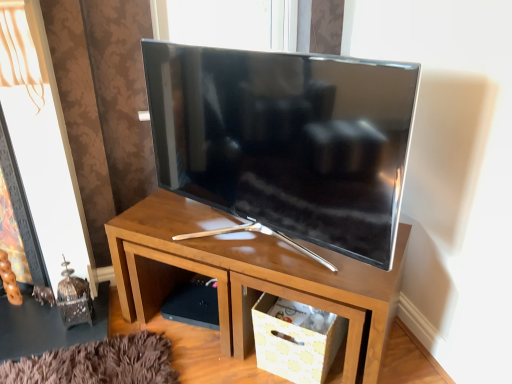
Question: Does wooden tv stand at center appear on the left side of white paper storage box at lower right?

Choices:
 (A) yes
 (B) no

Answer: (A)

Question: From the image's perspective, is wooden tv stand at center below white paper storage box at lower right?

Choices:
 (A) yes
 (B) no

Answer: (B)

Question: Could you tell me if wooden tv stand at center is facing white paper storage box at lower right?

Choices:
 (A) no
 (B) yes

Answer: (B)

Question: Is wooden tv stand at center to the right of white paper storage box at lower right from the viewer's perspective?

Choices:
 (A) no
 (B) yes

Answer: (A)

Question: Is wooden tv stand at center further to the viewer compared to white paper storage box at lower right?

Choices:
 (A) yes
 (B) no

Answer: (B)

Question: From the image's perspective, does wooden tv stand at center appear higher than white paper storage box at lower right?

Choices:
 (A) yes
 (B) no

Answer: (A)

Question: Does white paper storage box at lower right have a greater height compared to wooden tv stand at center?

Choices:
 (A) no
 (B) yes

Answer: (A)

Question: Can you confirm if white paper storage box at lower right is wider than wooden tv stand at center?

Choices:
 (A) no
 (B) yes

Answer: (A)

Question: Is white paper storage box at lower right further to the viewer compared to wooden tv stand at center?

Choices:
 (A) yes
 (B) no

Answer: (A)

Question: Can you confirm if white paper storage box at lower right is bigger than wooden tv stand at center?

Choices:
 (A) no
 (B) yes

Answer: (A)

Question: From the image's perspective, would you say white paper storage box at lower right is positioned over wooden tv stand at center?

Choices:
 (A) yes
 (B) no

Answer: (B)

Question: Does white paper storage box at lower right have a lesser width compared to wooden tv stand at center?

Choices:
 (A) no
 (B) yes

Answer: (B)

Question: Can you confirm if wooden tv stand at center is positioned to the right of satin black tv at center?

Choices:
 (A) yes
 (B) no

Answer: (A)